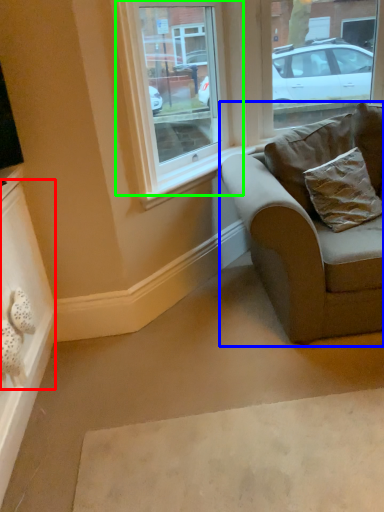
Question: Considering the real-world distances, which object is farthest from drawer (highlighted by a red box)? studio couch (highlighted by a blue box) or window (highlighted by a green box)?

Choices:
 (A) studio couch
 (B) window

Answer: (B)